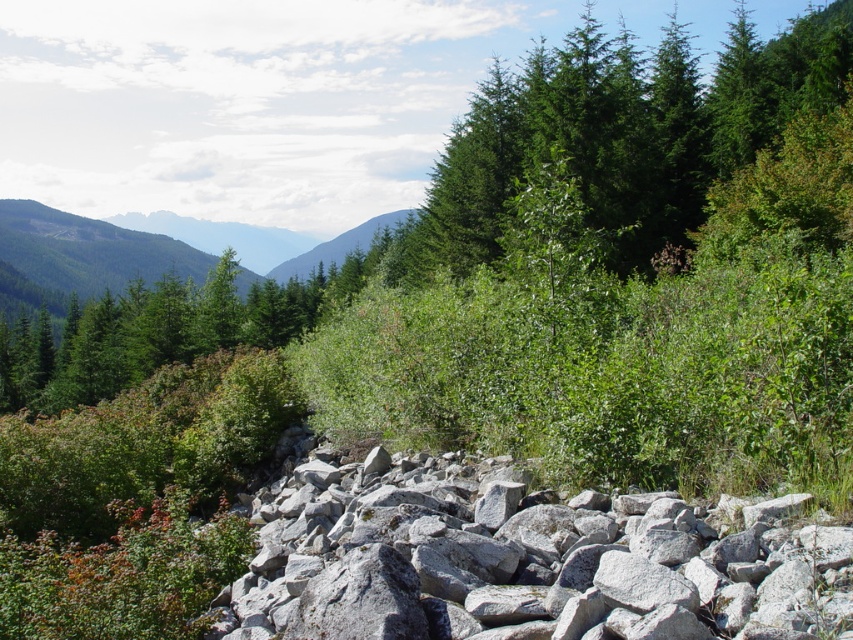
Is green glossy tree at upper right thinner than green forested mountain at upper left?

Correct, green glossy tree at upper right's width is less than green forested mountain at upper left's.

The width and height of the screenshot is (853, 640). What do you see at coordinates (619, 134) in the screenshot?
I see `green glossy tree at upper right` at bounding box center [619, 134].

Locate an element on the screen. The width and height of the screenshot is (853, 640). green glossy tree at upper right is located at coordinates (619, 134).

Which is below, gray/rough rock at center or green glossy tree at upper right?

Positioned lower is gray/rough rock at center.

Between gray/rough rock at center and green glossy tree at upper right, which one appears on the left side from the viewer's perspective?

From the viewer's perspective, gray/rough rock at center appears more on the left side.

What are the coordinates of `gray/rough rock at center` in the screenshot? It's located at (527, 561).

What do you see at coordinates (527, 561) in the screenshot?
I see `gray/rough rock at center` at bounding box center [527, 561].

Is point (495, 484) farther from camera compared to point (163, 257)?

No, (495, 484) is closer to viewer.

Identify the location of gray/rough rock at center. This screenshot has width=853, height=640. (527, 561).